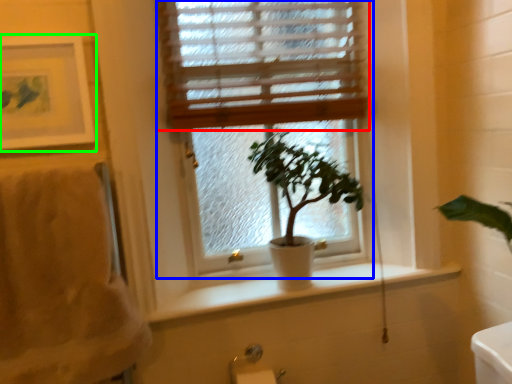
Question: Which object is positioned farthest from window blind (highlighted by a red box)? Select from window (highlighted by a blue box) and picture frame (highlighted by a green box).

Choices:
 (A) window
 (B) picture frame

Answer: (B)